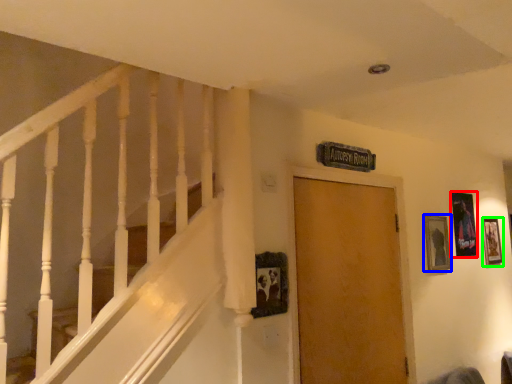
Question: Which is nearer to the picture frame (highlighted by a red box)? picture frame (highlighted by a blue box) or picture frame (highlighted by a green box).

Choices:
 (A) picture frame
 (B) picture frame

Answer: (A)